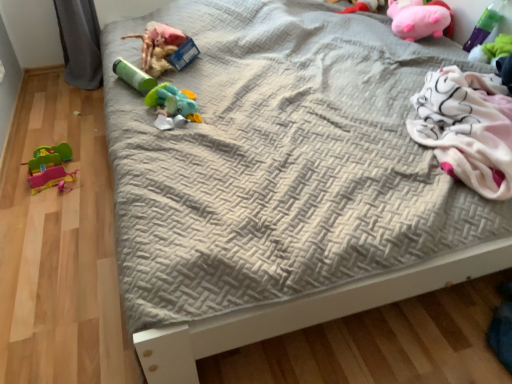
Describe the element at coordinates (134, 76) in the screenshot. The width and height of the screenshot is (512, 384). I see `green matte cylinder at center, the sixth toy from the right` at that location.

What is the approximate width of green matte cylinder at center, which is the 2th toy from left to right?

green matte cylinder at center, which is the 2th toy from left to right, is 24.19 centimeters wide.

This screenshot has height=384, width=512. What do you see at coordinates (49, 168) in the screenshot? I see `rubber duck at left, acting as the first toy starting from the left` at bounding box center [49, 168].

Locate an element on the screen. The width and height of the screenshot is (512, 384). pink plush pig at upper right, the 2th toy from the right is located at coordinates (419, 19).

The image size is (512, 384). What do you see at coordinates (158, 47) in the screenshot? I see `matte green tube at upper left, which is the 3th toy from left to right` at bounding box center [158, 47].

Identify the location of green matte cylinder at center, the sixth toy from the right. The image size is (512, 384). (134, 76).

From the rubber duck at left, which is the seventh toy in right-to-left order, count 3rd toys forward and point to it. Please provide its 2D coordinates.

[(173, 104)]

Is rubberized green and blue toy at center, which is the fourth toy in right-to-left order, to the right of rubber duck at left, acting as the first toy starting from the left, from the viewer's perspective?

Correct, you'll find rubberized green and blue toy at center, which is the fourth toy in right-to-left order, to the right of rubber duck at left, acting as the first toy starting from the left.

Is rubberized green and blue toy at center, the fourth toy in the left-to-right sequence, placed right next to rubber duck at left, acting as the first toy starting from the left?

No, rubberized green and blue toy at center, the fourth toy in the left-to-right sequence, is not touching rubber duck at left, acting as the first toy starting from the left.

From a real-world perspective, which is physically below, rubberized green and blue toy at center, which is the fourth toy in right-to-left order, or rubber duck at left, which is the seventh toy in right-to-left order?

rubber duck at left, which is the seventh toy in right-to-left order, from a real-world perspective.

Is rubber duck at left, which is the seventh toy in right-to-left order, not close to matte green tube at upper left, which is the 3th toy from left to right?

No.

From a real-world perspective, between rubber duck at left, which is the seventh toy in right-to-left order, and matte green tube at upper left, marked as the fifth toy in a right-to-left arrangement, who is vertically lower?

From a 3D spatial view, rubber duck at left, which is the seventh toy in right-to-left order, is below.

Locate an element on the screen. Image resolution: width=512 pixels, height=384 pixels. the 3rd toy above the rubber duck at left, acting as the first toy starting from the left (from the image's perspective) is located at coordinates (158, 47).

Is matte green tube at upper left, which is the 3th toy from left to right, inside rubber duck at left, acting as the first toy starting from the left?

Definitely not — matte green tube at upper left, which is the 3th toy from left to right, is not inside rubber duck at left, acting as the first toy starting from the left.

From the image's perspective, relative to rubber duck at left, acting as the first toy starting from the left, is pink plush pig at upper right, the 2th toy from the right, above or below?

From the image's perspective, pink plush pig at upper right, the 2th toy from the right, appears above rubber duck at left, acting as the first toy starting from the left.

Considering the sizes of objects pink plush pig at upper right, the 2th toy from the right, and rubber duck at left, which is the seventh toy in right-to-left order, in the image provided, who is shorter, pink plush pig at upper right, the 2th toy from the right, or rubber duck at left, which is the seventh toy in right-to-left order,?

With less height is rubber duck at left, which is the seventh toy in right-to-left order.

Looking at this image, considering the positions of objects pink plush pig at upper right, the 2th toy from the right, and rubber duck at left, which is the seventh toy in right-to-left order, in the image provided, who is more to the right, pink plush pig at upper right, the 2th toy from the right, or rubber duck at left, which is the seventh toy in right-to-left order,?

Positioned to the right is pink plush pig at upper right, the 2th toy from the right.

Where is `the 2nd toy directly above the rubber duck at left, acting as the first toy starting from the left (from a real-world perspective)`? the 2nd toy directly above the rubber duck at left, acting as the first toy starting from the left (from a real-world perspective) is located at coordinates coord(134,76).

Is green matte cylinder at center, the sixth toy from the right, surrounded by rubber duck at left, which is the seventh toy in right-to-left order?

No, green matte cylinder at center, the sixth toy from the right, is located outside of rubber duck at left, which is the seventh toy in right-to-left order.

Who is bigger, rubber duck at left, which is the seventh toy in right-to-left order, or green matte cylinder at center, which is the 2th toy from left to right?

rubber duck at left, which is the seventh toy in right-to-left order, is bigger.

From the image's perspective, is rubber duck at left, acting as the first toy starting from the left, positioned above or below green matte cylinder at center, which is the 2th toy from left to right?

From the image's perspective, rubber duck at left, acting as the first toy starting from the left, appears below green matte cylinder at center, which is the 2th toy from left to right.

Is there a large distance between pink plush toy at upper right, which is the third toy in right-to-left order, and rubberized green and blue toy at center, which is the fourth toy in right-to-left order?

pink plush toy at upper right, which is the third toy in right-to-left order, is positioned a significant distance from rubberized green and blue toy at center, which is the fourth toy in right-to-left order.

Is pink plush toy at upper right, which is the third toy in right-to-left order, in front of rubberized green and blue toy at center, the fourth toy in the left-to-right sequence?

No, pink plush toy at upper right, which is the third toy in right-to-left order, is further to the viewer.

Is pink plush toy at upper right, which appears as the fifth toy when viewed from the left, located outside rubberized green and blue toy at center, which is the fourth toy in right-to-left order?

Yes, pink plush toy at upper right, which appears as the fifth toy when viewed from the left, is not within rubberized green and blue toy at center, which is the fourth toy in right-to-left order.

Can you confirm if pink plush toy at upper right, which is the third toy in right-to-left order, is positioned to the right of rubberized green and blue toy at center, the fourth toy in the left-to-right sequence?

Correct, you'll find pink plush toy at upper right, which is the third toy in right-to-left order, to the right of rubberized green and blue toy at center, the fourth toy in the left-to-right sequence.

Does pink plush toy at upper right, which appears as the fifth toy when viewed from the left, lie behind green matte cylinder at center, which is the 2th toy from left to right?

Yes, it is.

Is pink plush toy at upper right, which appears as the fifth toy when viewed from the left, thinner than green matte cylinder at center, which is the 2th toy from left to right?

In fact, pink plush toy at upper right, which appears as the fifth toy when viewed from the left, might be wider than green matte cylinder at center, which is the 2th toy from left to right.

In the scene shown: From a real-world perspective, is pink plush toy at upper right, which is the third toy in right-to-left order, positioned under green matte cylinder at center, the sixth toy from the right, based on gravity?

No, from a real-world perspective, pink plush toy at upper right, which is the third toy in right-to-left order, is not under green matte cylinder at center, the sixth toy from the right.

Which object is positioned more to the left, pink plush toy at upper right, which appears as the fifth toy when viewed from the left, or green matte cylinder at center, which is the 2th toy from left to right?

Positioned to the left is green matte cylinder at center, which is the 2th toy from left to right.

Does green plastic toy at upper right, the 7th toy positioned from the left, have a larger size compared to green matte cylinder at center, the sixth toy from the right?

Indeed, green plastic toy at upper right, the 7th toy positioned from the left, has a larger size compared to green matte cylinder at center, the sixth toy from the right.

Is green plastic toy at upper right, arranged as the 1th toy when viewed from the right, positioned far away from green matte cylinder at center, which is the 2th toy from left to right?

green plastic toy at upper right, arranged as the 1th toy when viewed from the right, is positioned a significant distance from green matte cylinder at center, which is the 2th toy from left to right.

From a real-world perspective, is green plastic toy at upper right, arranged as the 1th toy when viewed from the right, beneath green matte cylinder at center, the sixth toy from the right?

Actually, green plastic toy at upper right, arranged as the 1th toy when viewed from the right, is physically above green matte cylinder at center, the sixth toy from the right, in the real world.

The image size is (512, 384). In order to click on the 3rd toy behind the rubberized green and blue toy at center, the fourth toy in the left-to-right sequence, starting your count from the anchor in this screenshot , I will do `click(49, 168)`.

At what (x,y) coordinates should I click in order to perform the action: click on toy that is the 2nd one when counting leftward from the matte green tube at upper left, which is the 3th toy from left to right. Please return your answer as a coordinate pair (x, y). This screenshot has width=512, height=384. Looking at the image, I should click on (49, 168).

When comparing their distances from rubber duck at left, acting as the first toy starting from the left, does green matte cylinder at center, the sixth toy from the right, or pink plush toy at upper right, which appears as the fifth toy when viewed from the left, seem closer?

green matte cylinder at center, the sixth toy from the right, lies closer to rubber duck at left, acting as the first toy starting from the left, than the other object.

When comparing their distances from green plastic toy at upper right, the 7th toy positioned from the left, does green matte cylinder at center, the sixth toy from the right, or rubber duck at left, which is the seventh toy in right-to-left order, seem further?

The object further to green plastic toy at upper right, the 7th toy positioned from the left, is rubber duck at left, which is the seventh toy in right-to-left order.

Looking at the image, which one is located further to rubberized green and blue toy at center, the fourth toy in the left-to-right sequence, matte green tube at upper left, marked as the fifth toy in a right-to-left arrangement, or green matte cylinder at center, the sixth toy from the right?

matte green tube at upper left, marked as the fifth toy in a right-to-left arrangement, is further to rubberized green and blue toy at center, the fourth toy in the left-to-right sequence.

When comparing their distances from rubber duck at left, acting as the first toy starting from the left, does rubberized green and blue toy at center, the fourth toy in the left-to-right sequence, or pink plush pig at upper right, which is the 6th toy from left to right, seem further?

The object further to rubber duck at left, acting as the first toy starting from the left, is pink plush pig at upper right, which is the 6th toy from left to right.

Estimate the real-world distances between objects in this image. Which object is further from rubber duck at left, which is the seventh toy in right-to-left order, green plastic toy at upper right, arranged as the 1th toy when viewed from the right, or pink plush pig at upper right, which is the 6th toy from left to right?

green plastic toy at upper right, arranged as the 1th toy when viewed from the right, is positioned further to the anchor rubber duck at left, which is the seventh toy in right-to-left order.

From the image, which object appears to be farther from pink plush toy at upper right, which appears as the fifth toy when viewed from the left, green plastic toy at upper right, the 7th toy positioned from the left, or green matte cylinder at center, which is the 2th toy from left to right?

Among the two, green matte cylinder at center, which is the 2th toy from left to right, is located further to pink plush toy at upper right, which appears as the fifth toy when viewed from the left.

Based on their spatial positions, is green matte cylinder at center, which is the 2th toy from left to right, or pink plush toy at upper right, which is the third toy in right-to-left order, further from matte green tube at upper left, marked as the fifth toy in a right-to-left arrangement?

The object further to matte green tube at upper left, marked as the fifth toy in a right-to-left arrangement, is pink plush toy at upper right, which is the third toy in right-to-left order.

Which object lies further to the anchor point pink plush toy at upper right, which is the third toy in right-to-left order, green plastic toy at upper right, arranged as the 1th toy when viewed from the right, or rubberized green and blue toy at center, which is the fourth toy in right-to-left order?

Among the two, rubberized green and blue toy at center, which is the fourth toy in right-to-left order, is located further to pink plush toy at upper right, which is the third toy in right-to-left order.

Locate an element on the screen. The image size is (512, 384). toy between green plastic toy at upper right, arranged as the 1th toy when viewed from the right, and pink plush toy at upper right, which appears as the fifth toy when viewed from the left, along the z-axis is located at coordinates (419, 19).

In order to click on toy between matte green tube at upper left, marked as the fifth toy in a right-to-left arrangement, and pink plush toy at upper right, which is the third toy in right-to-left order in this screenshot , I will do `click(173, 104)`.

At what (x,y) coordinates should I click in order to perform the action: click on toy between rubberized green and blue toy at center, the fourth toy in the left-to-right sequence, and pink plush pig at upper right, the 2th toy from the right. Please return your answer as a coordinate pair (x, y). The image size is (512, 384). Looking at the image, I should click on (362, 6).

Find the location of a particular element. The width and height of the screenshot is (512, 384). toy that lies between matte green tube at upper left, which is the 3th toy from left to right, and rubberized green and blue toy at center, the fourth toy in the left-to-right sequence, from top to bottom is located at coordinates (134, 76).